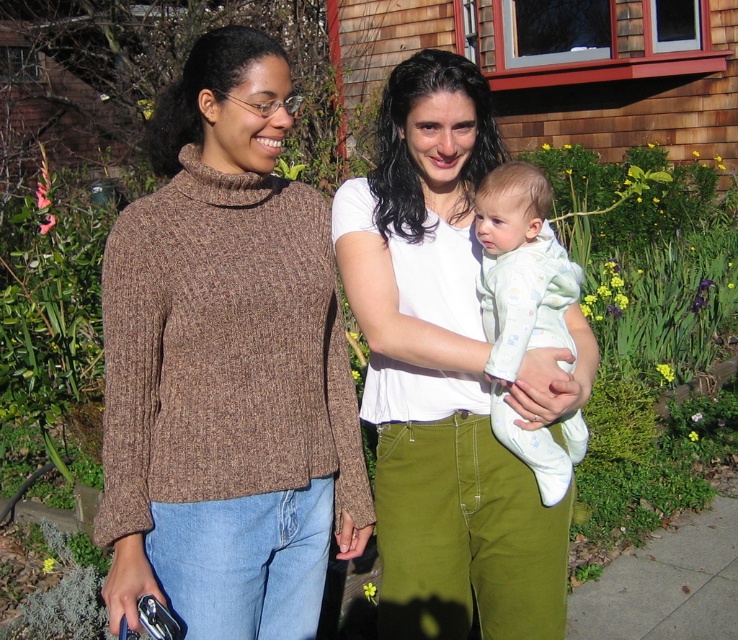
Question: Can you confirm if light blue cotton onesie at center is positioned to the left of gray concrete sidewalk at lower right?

Choices:
 (A) no
 (B) yes

Answer: (B)

Question: Among these points, which one is farthest from the camera?

Choices:
 (A) (289, 276)
 (B) (723, 547)

Answer: (B)

Question: Considering the relative positions of white cotton shirt at center and gray concrete sidewalk at lower right in the image provided, where is white cotton shirt at center located with respect to gray concrete sidewalk at lower right?

Choices:
 (A) below
 (B) above

Answer: (B)

Question: Does white cotton shirt at center come in front of light blue cotton onesie at center?

Choices:
 (A) no
 (B) yes

Answer: (A)

Question: Which of the following is the farthest from the observer?

Choices:
 (A) (570, 612)
 (B) (435, 356)
 (C) (365, 490)

Answer: (A)

Question: Among these points, which one is nearest to the camera?

Choices:
 (A) (700, 529)
 (B) (384, 355)
 (C) (187, 246)

Answer: (C)